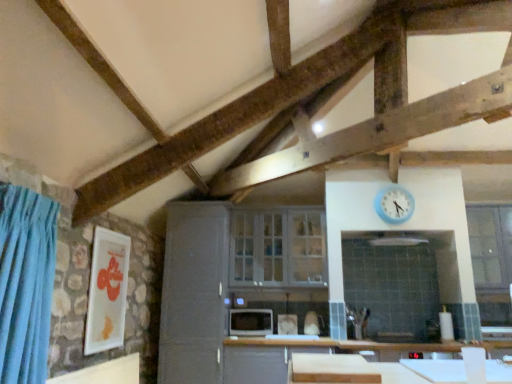
The width and height of the screenshot is (512, 384). Identify the location of matte black microwave at center. (250, 322).

What do you see at coordinates (250, 322) in the screenshot? I see `matte black microwave at center` at bounding box center [250, 322].

Describe the element at coordinates (194, 293) in the screenshot. I see `satin gray cabinet at center` at that location.

The width and height of the screenshot is (512, 384). Identify the location of white matte cutting board at lower center. (332, 369).

Image resolution: width=512 pixels, height=384 pixels. I want to click on blue velvet curtain at left, so click(x=26, y=283).

I want to click on white glass cabinet at center, acting as the 2th window starting from the right, so click(278, 248).

At what (x,y) coordinates should I click in order to perform the action: click on matte black microwave at center. Please return your answer as a coordinate pair (x, y). Looking at the image, I should click on (250, 322).

Does matte black microwave at center come behind blue velvet curtain at left?

Yes, it is behind blue velvet curtain at left.

Which object is positioned more to the right, matte black microwave at center or blue velvet curtain at left?

From the viewer's perspective, matte black microwave at center appears more on the right side.

Does matte black microwave at center have a smaller size compared to blue velvet curtain at left?

Yes, matte black microwave at center is smaller than blue velvet curtain at left.

Locate an element on the screen. clock located above the matte black microwave at center (from the image's perspective) is located at coordinates (394, 204).

Is blue plastic clock at upper right at the left side of matte black microwave at center?

In fact, blue plastic clock at upper right is to the right of matte black microwave at center.

Between blue plastic clock at upper right and matte black microwave at center, which one has less height?

With less height is matte black microwave at center.

What's the angular difference between white matte cutting board at lower center and satin gray cabinet at center's facing directions?

white matte cutting board at lower center and satin gray cabinet at center are facing 0.357 degrees away from each other.

Which is farther, (352, 360) or (214, 277)?

The point (214, 277) is more distant.

Is white matte cutting board at lower center thinner than satin gray cabinet at center?

Incorrect, the width of white matte cutting board at lower center is not less than that of satin gray cabinet at center.

Which of these two, white matte cutting board at lower center or satin gray cabinet at center, stands taller?

Standing taller between the two is satin gray cabinet at center.

Considering the relative sizes of clear glass window at right, positioned as the 2th window in left-to-right order, and satin gray cabinet at center in the image provided, is clear glass window at right, positioned as the 2th window in left-to-right order, thinner than satin gray cabinet at center?

Correct, the width of clear glass window at right, positioned as the 2th window in left-to-right order, is less than that of satin gray cabinet at center.

Does clear glass window at right, acting as the first window starting from the right, turn towards satin gray cabinet at center?

No, clear glass window at right, acting as the first window starting from the right, is not oriented towards satin gray cabinet at center.

From a real-world perspective, between clear glass window at right, positioned as the 2th window in left-to-right order, and satin gray cabinet at center, who is vertically higher?

From a 3D spatial view, clear glass window at right, positioned as the 2th window in left-to-right order, is above.

Is clear glass window at right, positioned as the 2th window in left-to-right order, further to camera compared to satin gray cabinet at center?

Yes, the depth of clear glass window at right, positioned as the 2th window in left-to-right order, is greater than that of satin gray cabinet at center.

Is matte white picture frame at left facing away from blue plastic clock at upper right?

That's not correct — matte white picture frame at left is not looking away from blue plastic clock at upper right.

What's the angular difference between matte white picture frame at left and blue plastic clock at upper right's facing directions?

They differ by 87.2 degrees in their facing directions.

Considering the positions of objects matte white picture frame at left and blue plastic clock at upper right in the image provided, who is more to the right, matte white picture frame at left or blue plastic clock at upper right?

Positioned to the right is blue plastic clock at upper right.

From the image's perspective, relative to blue plastic clock at upper right, is matte white picture frame at left above or below?

matte white picture frame at left is situated lower than blue plastic clock at upper right in the image.

From the image's perspective, is white glass cabinet at center, marked as the first window in a left-to-right arrangement, below satin gray cabinet at center?

No.

Consider the image. Relative to satin gray cabinet at center, is white glass cabinet at center, marked as the first window in a left-to-right arrangement, in front or behind?

Visually, white glass cabinet at center, marked as the first window in a left-to-right arrangement, is located behind satin gray cabinet at center.

Does white glass cabinet at center, acting as the 2th window starting from the right, contain satin gray cabinet at center?

Definitely not — satin gray cabinet at center is not inside white glass cabinet at center, acting as the 2th window starting from the right.

How many degrees apart are the facing directions of white glass cabinet at center, acting as the 2th window starting from the right, and satin gray cabinet at center?

The angular difference between white glass cabinet at center, acting as the 2th window starting from the right, and satin gray cabinet at center is 0.498 degrees.

In the image, is matte black microwave at center on the left side or the right side of matte white picture frame at left?

Clearly, matte black microwave at center is on the right of matte white picture frame at left in the image.

At what (x,y) coordinates should I click in order to perform the action: click on picture frame located above the matte black microwave at center (from the image's perspective). Please return your answer as a coordinate pair (x, y). Looking at the image, I should click on (106, 291).

Considering their positions, is matte black microwave at center located in front of or behind matte white picture frame at left?

Clearly, matte black microwave at center is behind matte white picture frame at left.

Image resolution: width=512 pixels, height=384 pixels. Find the location of `curtain on the left side of matte black microwave at center`. curtain on the left side of matte black microwave at center is located at coordinates (26, 283).

Find the location of `appliance lying behind the blue plastic clock at upper right`. appliance lying behind the blue plastic clock at upper right is located at coordinates (250, 322).

Considering their positions, is white matte cutting board at lower center positioned further to clear glass window at right, positioned as the 2th window in left-to-right order, than satin gray cabinet at center?

satin gray cabinet at center is positioned further to the anchor clear glass window at right, positioned as the 2th window in left-to-right order.

Based on their spatial positions, is matte black microwave at center or blue velvet curtain at left closer to white matte cutting board at lower center?

matte black microwave at center is positioned closer to the anchor white matte cutting board at lower center.

Looking at the image, which one is located further to clear glass window at right, acting as the first window starting from the right, matte black microwave at center or matte white picture frame at left?

matte white picture frame at left is positioned further to the anchor clear glass window at right, acting as the first window starting from the right.

Based on their spatial positions, is satin gray cabinet at center or white glass cabinet at center, acting as the 2th window starting from the right, further from matte white picture frame at left?

white glass cabinet at center, acting as the 2th window starting from the right, is further to matte white picture frame at left.

In the scene shown: When comparing their distances from white glass cabinet at center, marked as the first window in a left-to-right arrangement, does satin gray cabinet at center or matte black microwave at center seem further?

Among the two, matte black microwave at center is located further to white glass cabinet at center, marked as the first window in a left-to-right arrangement.

Based on the photo, looking at the image, which one is located closer to satin gray cabinet at center, blue plastic clock at upper right or clear glass window at right, acting as the first window starting from the right?

blue plastic clock at upper right lies closer to satin gray cabinet at center than the other object.

Looking at the image, which one is located closer to white glass cabinet at center, marked as the first window in a left-to-right arrangement, matte white picture frame at left or blue plastic clock at upper right?

blue plastic clock at upper right.

From the image, which object appears to be nearer to clear glass window at right, acting as the first window starting from the right, blue plastic clock at upper right or matte black microwave at center?

blue plastic clock at upper right is closer to clear glass window at right, acting as the first window starting from the right.

Find the location of a particular element. picture frame between white matte cutting board at lower center and matte black microwave at center along the z-axis is located at coordinates (106, 291).

Locate an element on the screen. window between white matte cutting board at lower center and white glass cabinet at center, marked as the first window in a left-to-right arrangement, along the z-axis is located at coordinates point(492,261).

Where is `cabinetry between matte white picture frame at left and matte black microwave at center from front to back`? cabinetry between matte white picture frame at left and matte black microwave at center from front to back is located at coordinates (194, 293).

Identify the location of window between matte white picture frame at left and blue plastic clock at upper right in the horizontal direction. Image resolution: width=512 pixels, height=384 pixels. (278, 248).